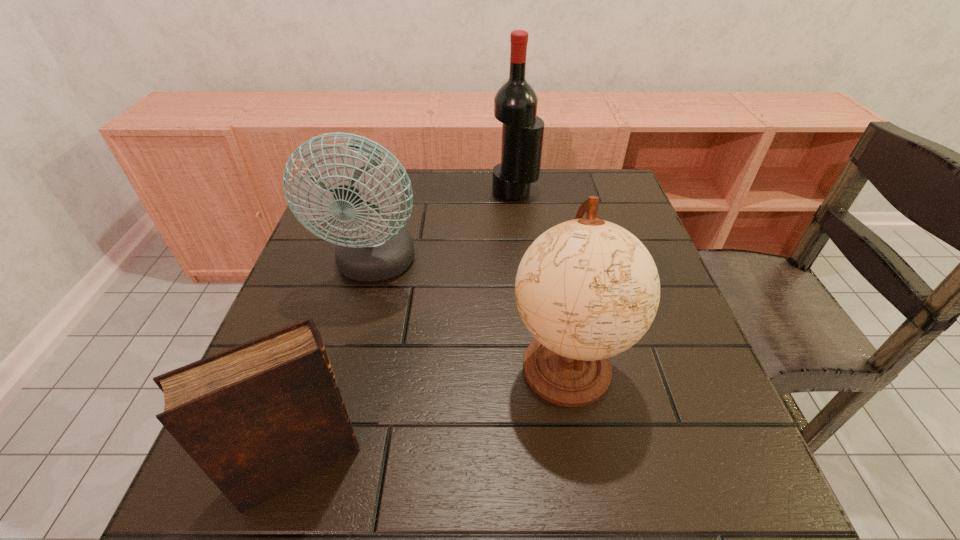
You are a GUI agent. You are given a task and a screenshot of the screen. Output one action in this format:
    pyautogui.click(x=<x>, y=<y>)
    Task: Click on the object that is at the near edge
    
    Given the screenshot: What is the action you would take?
    pyautogui.click(x=258, y=418)

This screenshot has height=540, width=960. I want to click on fan situated at the left edge, so click(370, 249).

Locate an element on the screen. Bible located at the left edge is located at coordinates (258, 418).

At what (x,y) coordinates should I click in order to perform the action: click on object that is at the right edge. Please return your answer as a coordinate pair (x, y). The image size is (960, 540). Looking at the image, I should click on 587,289.

Locate an element on the screen. object that is at the near left corner is located at coordinates click(x=258, y=418).

In the image, there is a desktop. Where is `vacant space at the far edge`? The height and width of the screenshot is (540, 960). vacant space at the far edge is located at coordinates (546, 182).

At what (x,y) coordinates should I click in order to perform the action: click on vacant space at the near edge. Please return your answer as a coordinate pair (x, y). Looking at the image, I should click on (421, 474).

Image resolution: width=960 pixels, height=540 pixels. I want to click on free space at the left edge of the desktop, so click(x=326, y=243).

The image size is (960, 540). In the image, there is a desktop. In order to click on vacant space at the right edge in this screenshot , I will do `click(642, 418)`.

In the image, there is a desktop. Where is `vacant space at the near left corner`? The image size is (960, 540). vacant space at the near left corner is located at coordinates (195, 525).